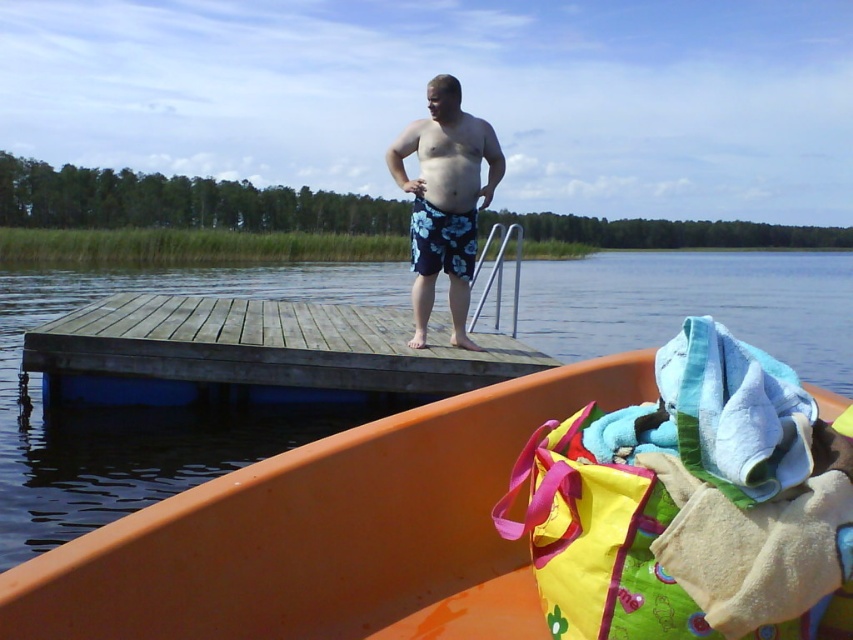
You are a lifeguard on duty at the lakeside. You notice the orange plastic boat at center and the blue floral shorts at center in the scene. Which object takes up more space in the image?

The orange plastic boat at center has a larger size compared to the blue floral shorts at center, so it takes up more space in the image.

You are planning to place the orange plastic boat at center onto the weathered wood dock at center. Based on their widths, will the boat fit entirely on the dock?

The orange plastic boat at center is narrower than the weathered wood dock at center, so it will fit entirely on the dock.